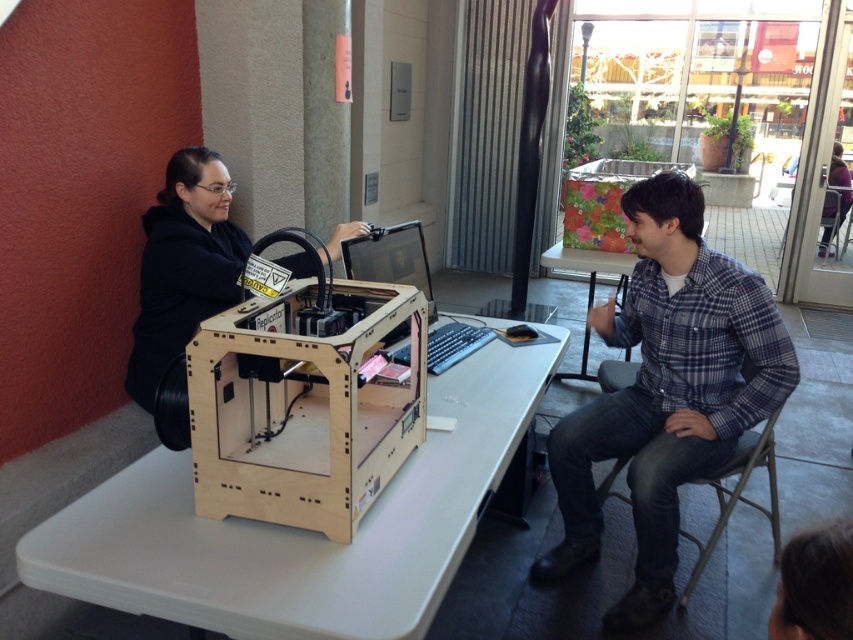
Question: Which of the following is the closest to the observer?

Choices:
 (A) (521, 355)
 (B) (427, 300)
 (C) (229, 305)

Answer: (C)

Question: Which object appears farthest from the camera in this image?

Choices:
 (A) light wood table at center
 (B) black matte 3d printer at left
 (C) plaid flannel shirt at right

Answer: (B)

Question: Is plaid flannel shirt at right positioned at the back of black matte 3d printer at left?

Choices:
 (A) no
 (B) yes

Answer: (A)

Question: Which object appears farthest from the camera in this image?

Choices:
 (A) light wood table at center
 (B) plaid flannel shirt at right
 (C) black matte 3d printer at left
 (D) matte black laptop at center

Answer: (C)

Question: Where is plaid flannel shirt at right located in relation to matte black laptop at center in the image?

Choices:
 (A) left
 (B) right

Answer: (B)

Question: Can you confirm if black matte 3d printer at left is thinner than matte black laptop at center?

Choices:
 (A) no
 (B) yes

Answer: (A)